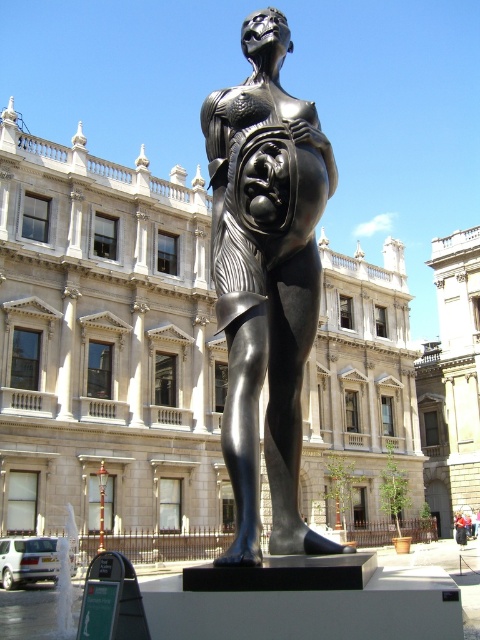
Question: Which point appears farthest from the camera in this image?

Choices:
 (A) (283, 214)
 (B) (372, 365)
 (C) (460, 518)

Answer: (C)

Question: Which of the following is the farthest from the observer?

Choices:
 (A) (454, 518)
 (B) (365, 461)
 (C) (268, 44)

Answer: (A)

Question: Can you confirm if black polished statue at center is bigger than polished bronze statue at center?

Choices:
 (A) no
 (B) yes

Answer: (B)

Question: From the image, what is the correct spatial relationship of black polished statue at center in relation to dark blue jeans at center?

Choices:
 (A) above
 (B) below

Answer: (A)

Question: Can you confirm if black polished statue at center is positioned below dark blue jeans at center?

Choices:
 (A) no
 (B) yes

Answer: (A)

Question: Among these objects, which one is nearest to the camera?

Choices:
 (A) black polished statue at center
 (B) dark blue jeans at center

Answer: (A)